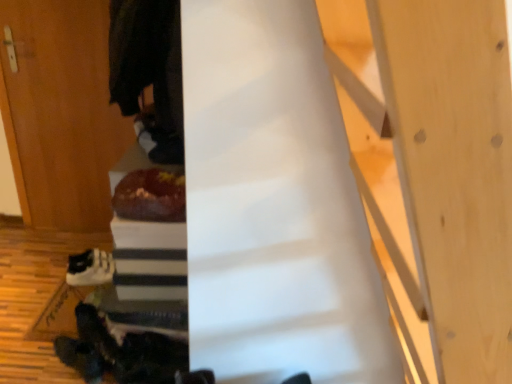
Image resolution: width=512 pixels, height=384 pixels. In order to click on free space in front of white matte sneakers at lower left in this screenshot , I will do `click(66, 303)`.